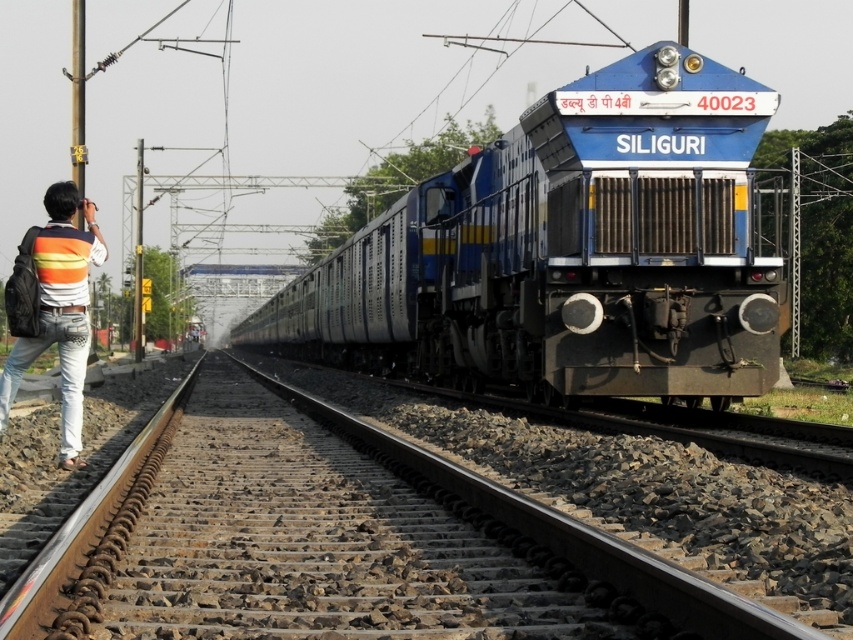
You are a photographer trying to capture the blue metallic train at center and the striped sweater at left in the same frame. Based on their positions, will the train appear higher or lower in the photo compared to the striped sweater?

The blue metallic train at center is located above the striped sweater at left, so in the photo, the train will appear higher than the striped sweater.

You are a photographer standing on the railway track. You see the blue metallic train at center and the striped sweater at left. Which object is closer to your right side?

The blue metallic train at center is to the right of striped sweater at left, so the blue metallic train at center is closer to your right side.